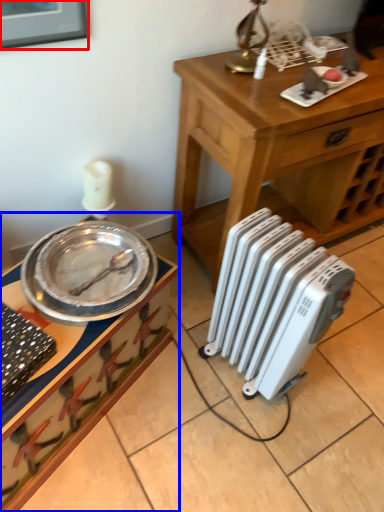
Question: Among these objects, which one is farthest to the camera, picture frame (highlighted by a red box) or desk (highlighted by a blue box)?

Choices:
 (A) picture frame
 (B) desk

Answer: (B)